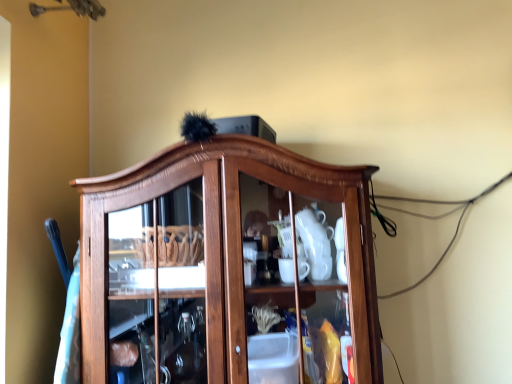
Identify the location of wooden cabinet at center. This screenshot has width=512, height=384. coord(228,269).

What do you see at coordinates (228, 269) in the screenshot?
I see `wooden cabinet at center` at bounding box center [228, 269].

You are a GUI agent. You are given a task and a screenshot of the screen. Output one action in this format:
    pyautogui.click(x=<x>, y=<y>)
    Task: Click on the wooden cabinet at center
    The image size is (512, 384).
    Given the screenshot: What is the action you would take?
    pyautogui.click(x=228, y=269)